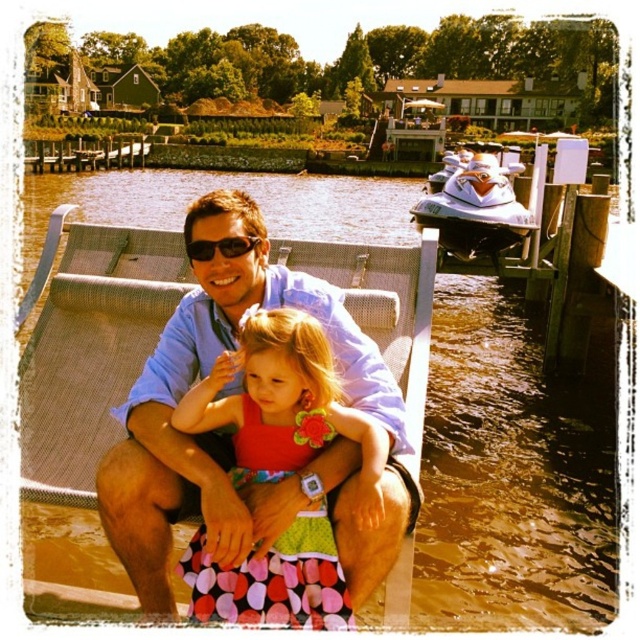
Question: In this image, where is matte blue shirt at center located relative to white glossy jet ski at right?

Choices:
 (A) below
 (B) above

Answer: (A)

Question: Which point is closer to the camera?

Choices:
 (A) (321, 612)
 (B) (244, 252)
 (C) (419, 209)

Answer: (A)

Question: Is matte blue shirt at center bigger than polka dot fabric dress at center?

Choices:
 (A) no
 (B) yes

Answer: (B)

Question: Among these objects, which one is farthest from the camera?

Choices:
 (A) white glossy jet ski at right
 (B) matte blue shirt at center
 (C) polka dot fabric dress at center

Answer: (A)

Question: Is matte blue shirt at center smaller than polka dot fabric dress at center?

Choices:
 (A) no
 (B) yes

Answer: (A)

Question: Which point is farther to the camera?

Choices:
 (A) (232, 248)
 (B) (422, 220)
 (C) (336, 342)

Answer: (B)